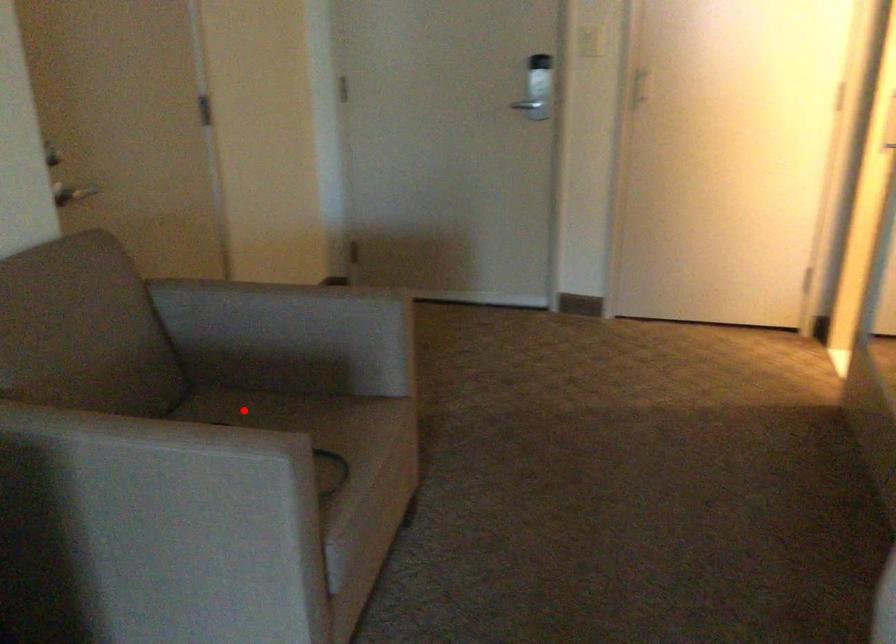
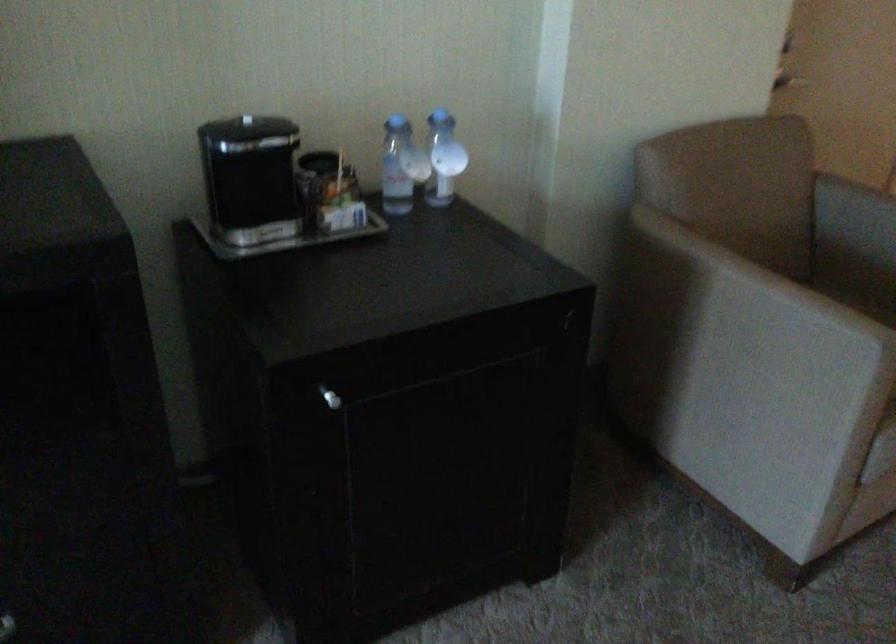
Find the pixel in the second image that matches the highlighted location in the first image.

(859, 303)